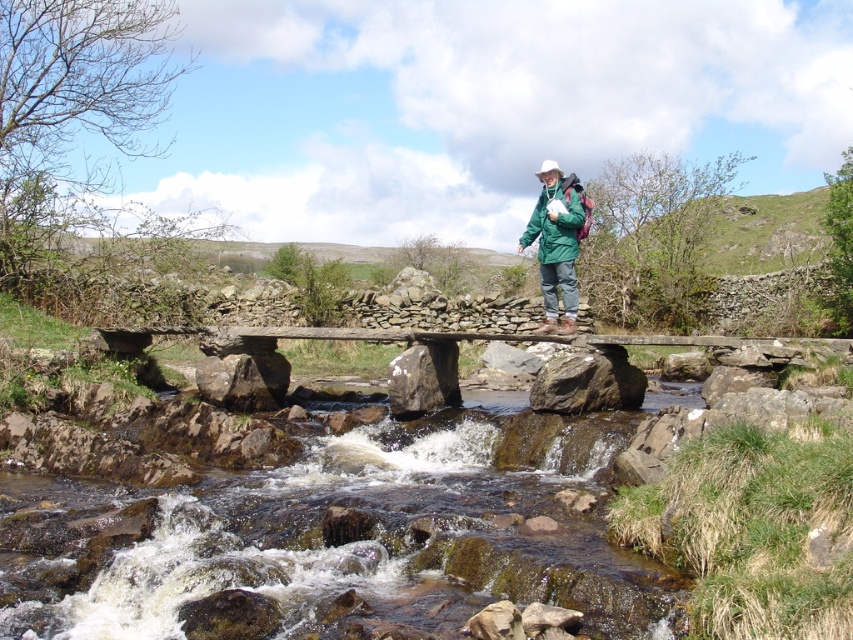
You are a hiker who wants to cross the rocky brown river at center. You notice the green fabric jacket at center nearby. Which object takes up more space in the scene?

The green fabric jacket at center takes up more space in the scene than the rocky brown river at center, according to the description.

You are a hiker who has just reached the stone bridge at center and the green fabric jacket at center. Which object is positioned to the right of the other?

The stone bridge at center is to the right of the green fabric jacket at center.

You are a hiker who needs to cross the rocky brown river at center. You have a 12 meter long rope. Can you safely use the rope to cross the river if you tie it to the bridge you are standing on?

The distance between the rocky brown river at center and the camera is 12.75 meters. Since the rope is only 12 meters long, it is 0.75 meters shorter than needed. Therefore, the rope would not be long enough to safely cross the river.